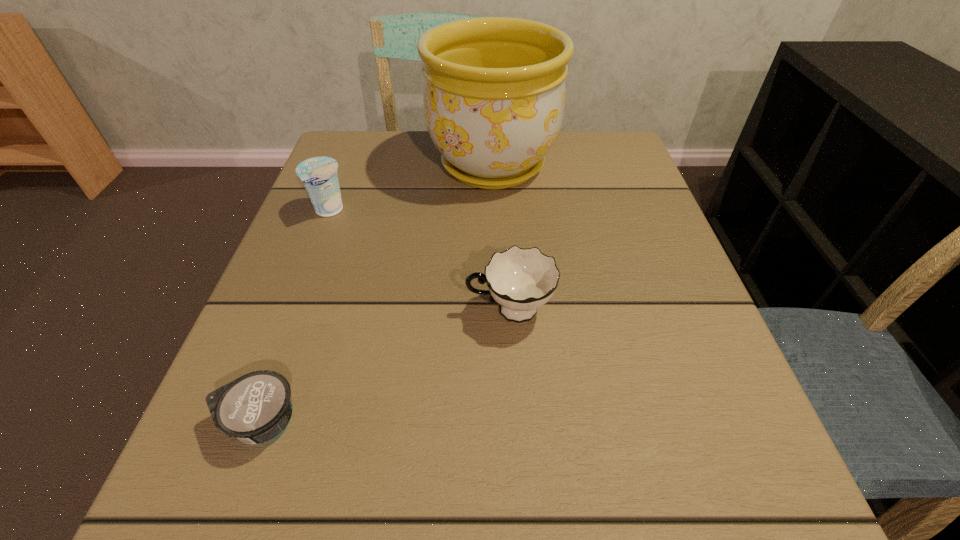
Locate an element on the screen. flowerpot is located at coordinates (494, 93).

Where is `the farther yogurt`? Image resolution: width=960 pixels, height=540 pixels. the farther yogurt is located at coordinates (319, 175).

Where is `cup`? The image size is (960, 540). cup is located at coordinates (521, 280).

This screenshot has width=960, height=540. I want to click on the shortest object, so click(255, 408).

Locate an element on the screen. The height and width of the screenshot is (540, 960). the nearest object is located at coordinates (255, 408).

Where is `free spot located 0.190m on the right of the flowerpot`? The image size is (960, 540). free spot located 0.190m on the right of the flowerpot is located at coordinates (638, 165).

Image resolution: width=960 pixels, height=540 pixels. Find the location of `free space located 0.110m on the front of the taller yogurt`. free space located 0.110m on the front of the taller yogurt is located at coordinates (308, 264).

Where is `vacant space situated on the side of the second nearest object with the handle`? vacant space situated on the side of the second nearest object with the handle is located at coordinates (374, 310).

Find the location of a particular element. This screenshot has width=960, height=540. vacant space located on the side of the second nearest object with the handle is located at coordinates (411, 310).

At what (x,y) coordinates should I click in order to perform the action: click on free point located on the side of the second nearest object with the handle. Please return your answer as a coordinate pair (x, y). The width and height of the screenshot is (960, 540). Looking at the image, I should click on (374, 310).